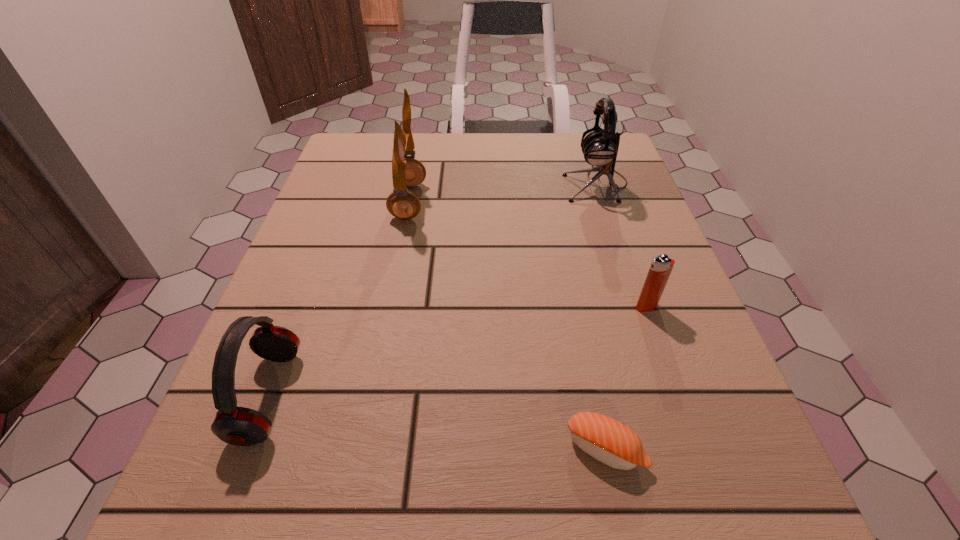
Locate an element on the screen. This screenshot has height=540, width=960. vacant space positioned on the back of the third farthest object is located at coordinates (637, 281).

Identify the location of vacant area situated 0.190m on the left of the sushi. (425, 449).

You are a GUI agent. You are given a task and a screenshot of the screen. Output one action in this format:
    pyautogui.click(x=<x>, y=<y>)
    Task: Click on the object located at the left edge
    
    Given the screenshot: What is the action you would take?
    pyautogui.click(x=240, y=426)

The height and width of the screenshot is (540, 960). What are the coordinates of `earphone that is at the right edge` in the screenshot? It's located at (600, 148).

What are the coordinates of `igniter located in the right edge section of the desktop` in the screenshot? It's located at (661, 267).

The height and width of the screenshot is (540, 960). Identify the location of sushi that is at the right edge. (607, 440).

Locate an element on the screen. This screenshot has width=960, height=540. object situated at the far right corner is located at coordinates (600, 148).

The image size is (960, 540). I want to click on vacant region at the far edge of the desktop, so click(421, 159).

Image resolution: width=960 pixels, height=540 pixels. What are the coordinates of `blank space at the near edge of the desktop` in the screenshot? It's located at (642, 503).

In order to click on free space at the left edge of the desktop in this screenshot , I will do `click(365, 213)`.